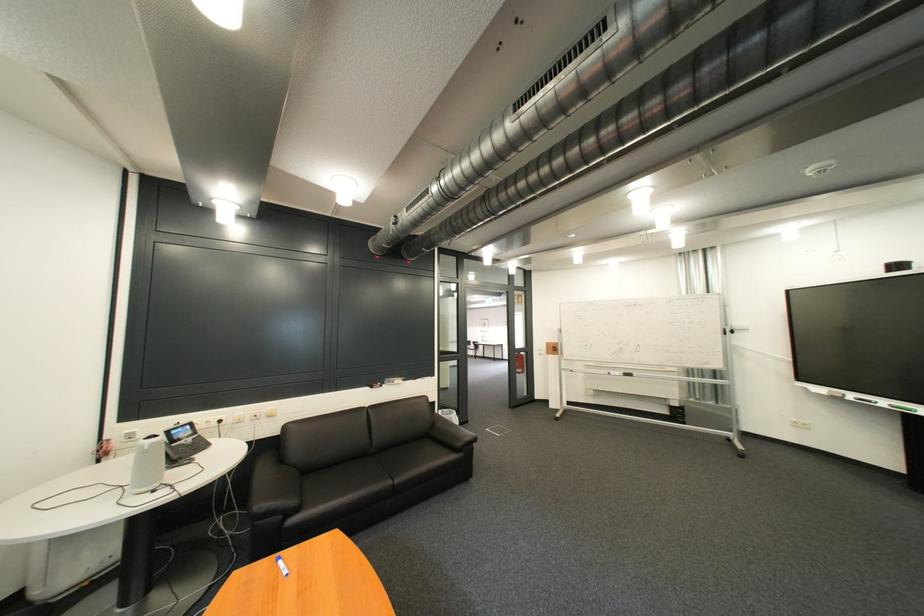
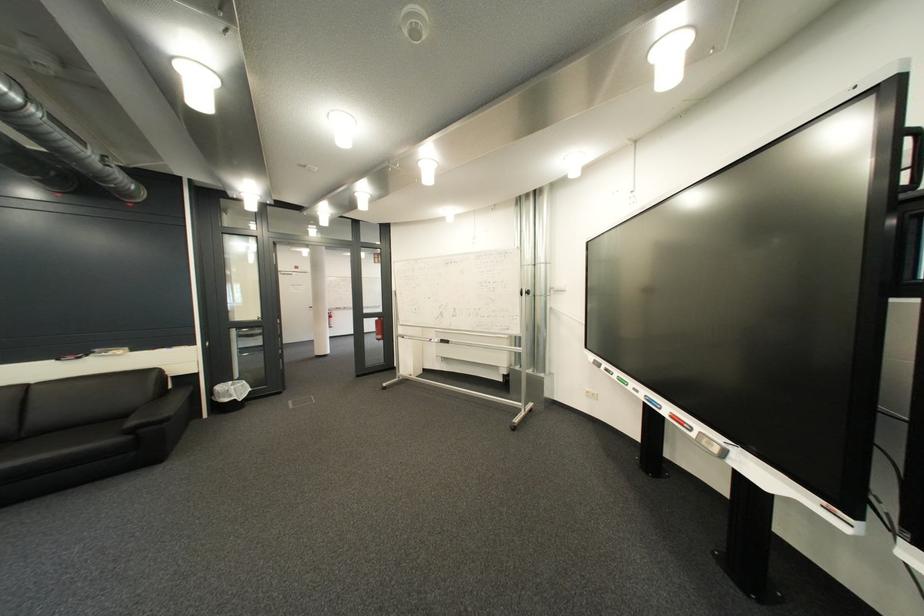
Locate, in the second image, the point that corresponds to the point at 676,371 in the first image.

(509, 338)